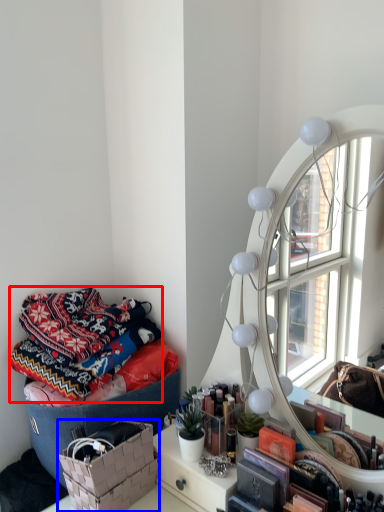
Question: Which object is closer to the camera taking this photo, blanket (highlighted by a red box) or basket (highlighted by a blue box)?

Choices:
 (A) blanket
 (B) basket

Answer: (B)